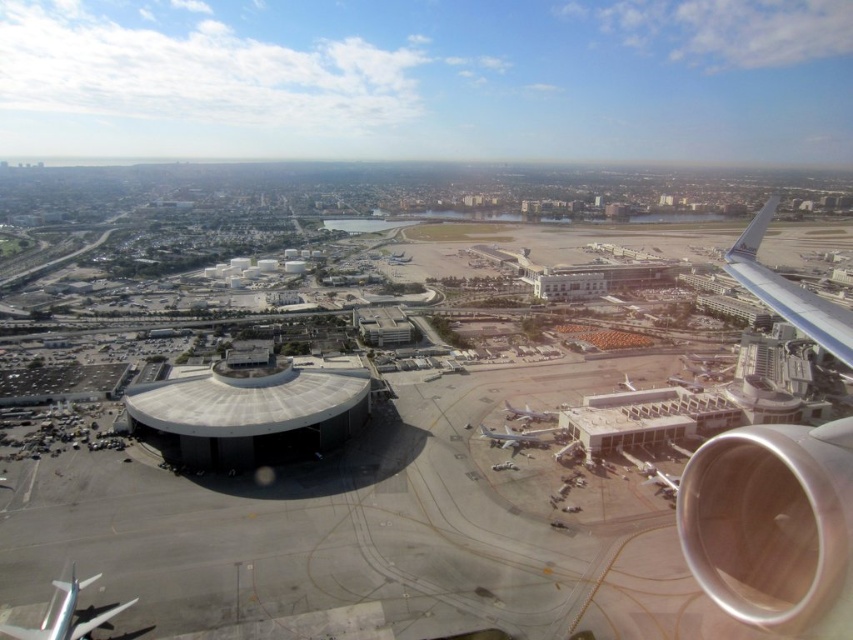
Which of these two, silver metallic engine at right or white matte airplane at center, stands shorter?

Standing shorter between the two is white matte airplane at center.

Is silver metallic engine at right thinner than white matte airplane at center?

No, silver metallic engine at right is not thinner than white matte airplane at center.

Is point (706, 456) positioned before point (544, 417)?

Yes, it is.

In order to click on silver metallic engine at right in this screenshot , I will do `click(773, 525)`.

Who is positioned more to the left, smooth concrete tarmac at center or white matte airplane at center?

Positioned to the left is white matte airplane at center.

What do you see at coordinates (306, 538) in the screenshot?
I see `smooth concrete tarmac at center` at bounding box center [306, 538].

Is point (51, 540) closer to viewer compared to point (503, 401)?

Yes, point (51, 540) is closer to viewer.

The width and height of the screenshot is (853, 640). Identify the location of smooth concrete tarmac at center. (306, 538).

Does blue metallic wing at upper right have a lesser width compared to white matte airplane at center?

In fact, blue metallic wing at upper right might be wider than white matte airplane at center.

In the scene shown: Can you confirm if blue metallic wing at upper right is bigger than white matte airplane at center?

Correct, blue metallic wing at upper right is larger in size than white matte airplane at center.

The height and width of the screenshot is (640, 853). Find the location of `blue metallic wing at upper right`. blue metallic wing at upper right is located at coordinates (788, 291).

Find the location of a particular element. Image resolution: width=853 pixels, height=640 pixels. blue metallic wing at upper right is located at coordinates (788, 291).